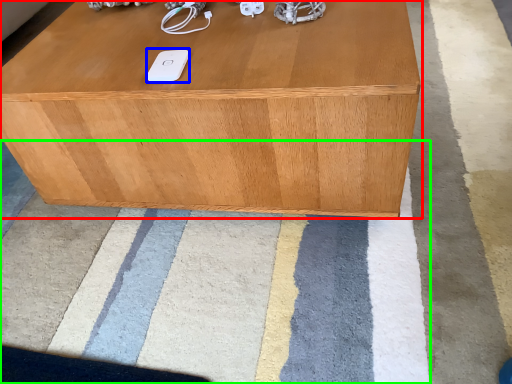
Question: Which object is positioned farthest from table (highlighted by a red box)? Select from ipod (highlighted by a blue box) and mat (highlighted by a green box).

Choices:
 (A) ipod
 (B) mat

Answer: (B)